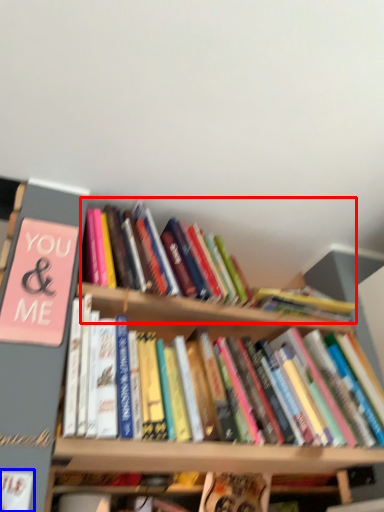
Question: Which object is further to the camera taking this photo, book (highlighted by a red box) or book (highlighted by a blue box)?

Choices:
 (A) book
 (B) book

Answer: (A)